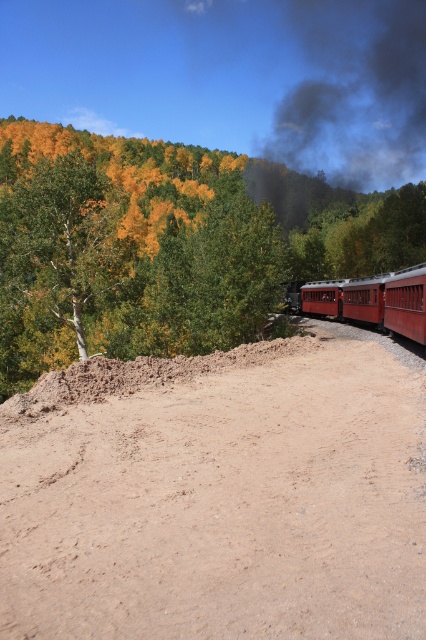
Question: Estimate the real-world distances between objects in this image. Which object is farther from the smooth white tree at left?

Choices:
 (A) brown sandy dirt track at lower center
 (B) red polished wood train at right

Answer: (A)

Question: Among these objects, which one is nearest to the camera?

Choices:
 (A) brown sandy dirt track at lower center
 (B) red polished wood train at right
 (C) dark gray smoke at upper center
 (D) smooth white tree at left

Answer: (A)

Question: Can you confirm if dark gray smoke at upper center is bigger than smooth white tree at left?

Choices:
 (A) no
 (B) yes

Answer: (B)

Question: Can you confirm if brown sandy dirt track at lower center is positioned to the right of red polished wood train at right?

Choices:
 (A) no
 (B) yes

Answer: (A)

Question: Estimate the real-world distances between objects in this image. Which object is closer to the brown sandy dirt track at lower center?

Choices:
 (A) red polished wood train at right
 (B) dark gray smoke at upper center
 (C) smooth white tree at left

Answer: (A)

Question: Considering the relative positions of brown sandy dirt track at lower center and smooth white tree at left in the image provided, where is brown sandy dirt track at lower center located with respect to smooth white tree at left?

Choices:
 (A) below
 (B) above

Answer: (A)